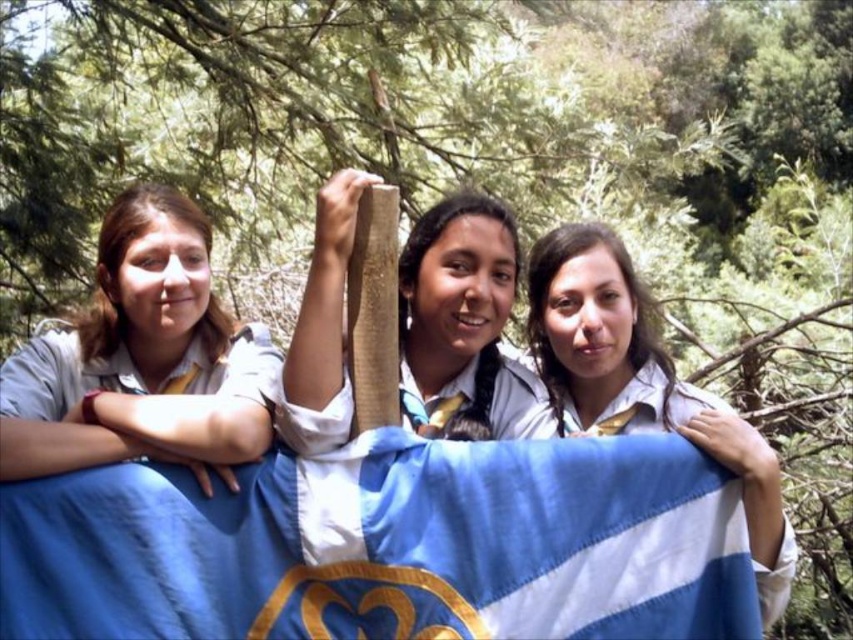
Question: Which object is positioned closest to the blue striped fabric at center?

Choices:
 (A) blue fabric flag at center
 (B) matte wooden stick at center

Answer: (B)

Question: Observing the image, what is the correct spatial positioning of light brown shirt at left in reference to blue striped fabric at center?

Choices:
 (A) right
 (B) left

Answer: (B)

Question: Which is farther from the light brown shirt at left?

Choices:
 (A) blue fabric flag at center
 (B) blue striped fabric at center
 (C) matte wooden stick at center

Answer: (B)

Question: Does light brown shirt at left appear over matte wooden stick at center?

Choices:
 (A) no
 (B) yes

Answer: (A)

Question: Which object is the farthest from the blue fabric flag at center?

Choices:
 (A) blue striped fabric at center
 (B) light brown shirt at left

Answer: (A)

Question: Is blue fabric flag at center wider than light brown shirt at left?

Choices:
 (A) yes
 (B) no

Answer: (A)